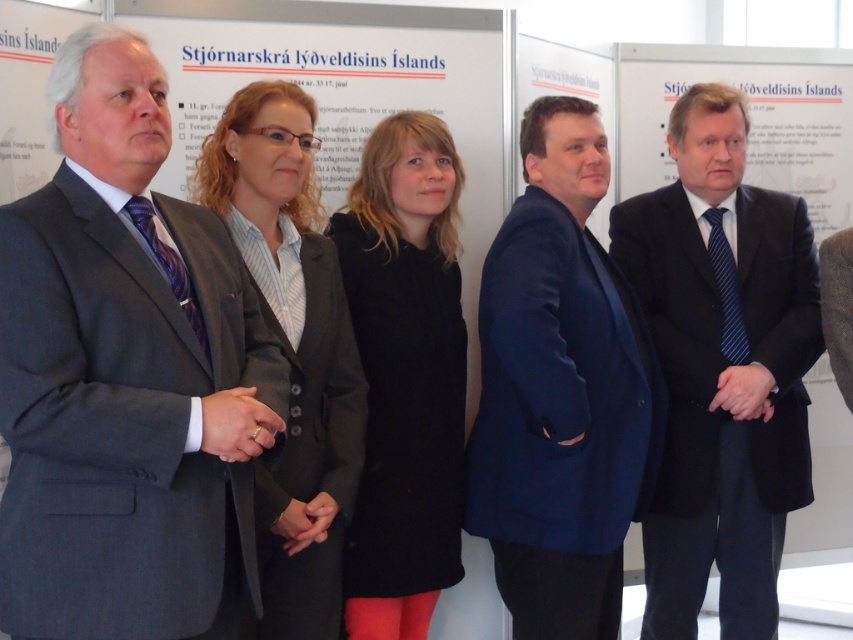
You are a photographer adjusting camera settings to capture a group photo of the five individuals. You need to ensure both the matte black suit at center and the matte black blazer at center are clearly visible. Which clothing item requires more focus adjustment due to its height?

The matte black suit at center requires more focus adjustment because it has a greater height compared to the matte black blazer at center, making it stand out more in the frame.

You are standing in the room where the image was taken and want to locate the blue fabric suit at center. Where should you look?

You should look at the point with coordinates (560, 392) to find the blue fabric suit at center.

You are a photographer at a formal event. You need to capture a photo where both the blue fabric suit at center and the matte black blazer at center are clearly visible. Considering their positions, which one might you need to adjust to ensure both are in focus?

The matte black blazer at center is behind the blue fabric suit at center. To ensure both are in focus, you might need to adjust the matte black blazer at center to move it forward or the blue fabric suit at center to move it backward so they are at the same focal plane.